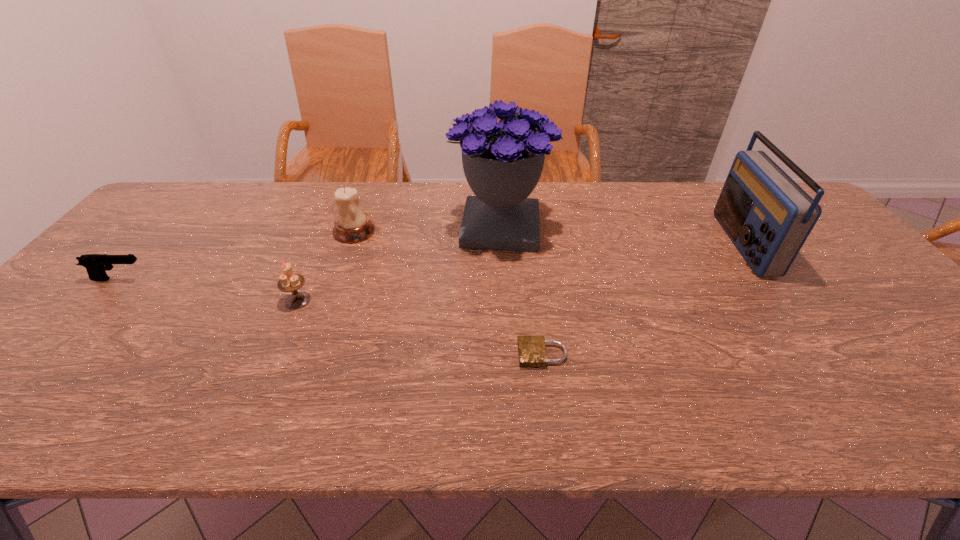
Point out which object is positioned as the second nearest to the pistol. Please provide its 2D coordinates. Your answer should be formatted as a tuple, i.e. [(x, y)], where the tuple contains the x and y coordinates of a point satisfying the conditions above.

[(352, 225)]

At what (x,y) coordinates should I click in order to perform the action: click on vacant point that satisfies the following two spatial constraints: 1. on the front-facing side of the nearer candle holder; 2. on the left side of the pistol. Please return your answer as a coordinate pair (x, y). This screenshot has width=960, height=540. Looking at the image, I should click on tap(100, 300).